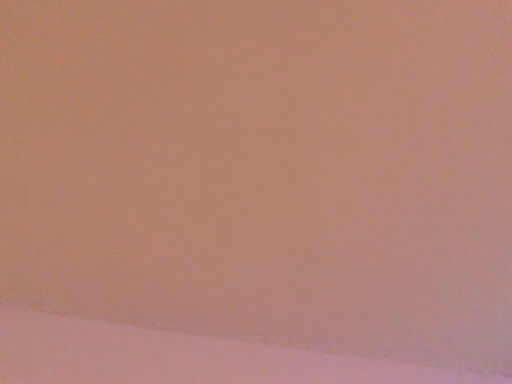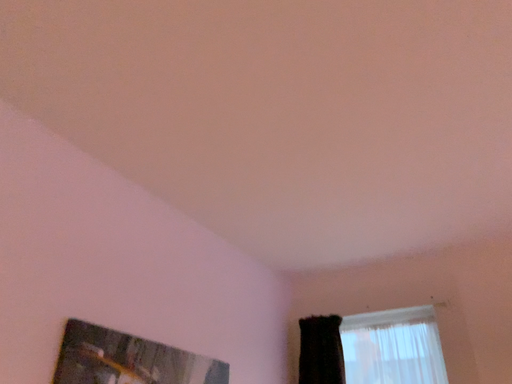
Question: How did the camera likely rotate when shooting the video?

Choices:
 (A) rotated downward
 (B) rotated upward

Answer: (A)